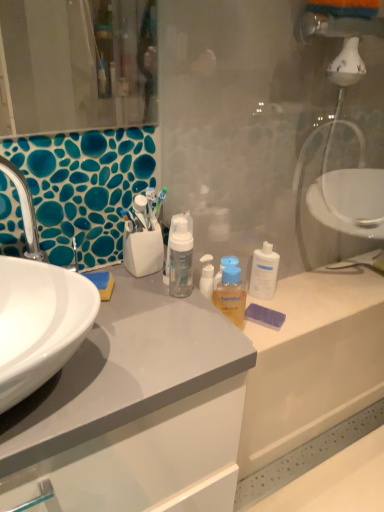
Question: Does white glossy sink at left have a lesser height compared to transparent plastic bottle at center?

Choices:
 (A) no
 (B) yes

Answer: (A)

Question: Is white glossy sink at left looking in the opposite direction of transparent plastic bottle at center?

Choices:
 (A) no
 (B) yes

Answer: (B)

Question: Can you confirm if white glossy sink at left is wider than transparent plastic bottle at center?

Choices:
 (A) yes
 (B) no

Answer: (A)

Question: Is white glossy sink at left outside transparent plastic bottle at center?

Choices:
 (A) no
 (B) yes

Answer: (B)

Question: Does white glossy sink at left have a greater height compared to transparent plastic bottle at center?

Choices:
 (A) yes
 (B) no

Answer: (A)

Question: Choose the correct answer: Is white glossy sink at left inside transparent plastic bottle at center or outside it?

Choices:
 (A) outside
 (B) inside

Answer: (A)

Question: From their relative heights in the image, would you say white glossy sink at left is taller or shorter than transparent plastic bottle at center?

Choices:
 (A) tall
 (B) short

Answer: (A)

Question: In terms of size, does white glossy sink at left appear bigger or smaller than transparent plastic bottle at center?

Choices:
 (A) small
 (B) big

Answer: (B)

Question: From the image's perspective, is white glossy sink at left above or below transparent plastic bottle at center?

Choices:
 (A) above
 (B) below

Answer: (A)

Question: Considering their positions, is transparent plastic bottle at center located in front of or behind transparent plastic glass door at center?

Choices:
 (A) behind
 (B) front

Answer: (A)

Question: Considering the positions of transparent plastic bottle at center and transparent plastic glass door at center in the image, is transparent plastic bottle at center taller or shorter than transparent plastic glass door at center?

Choices:
 (A) tall
 (B) short

Answer: (B)

Question: From the image's perspective, is transparent plastic bottle at center above or below transparent plastic glass door at center?

Choices:
 (A) below
 (B) above

Answer: (B)

Question: Considering the positions of transparent plastic bottle at center and transparent plastic glass door at center in the image, is transparent plastic bottle at center wider or thinner than transparent plastic glass door at center?

Choices:
 (A) wide
 (B) thin

Answer: (A)

Question: From the image's perspective, is white glossy sink at left positioned above or below translucent orange liquid at center?

Choices:
 (A) below
 (B) above

Answer: (B)

Question: Considering the relative positions of white glossy sink at left and translucent orange liquid at center in the image provided, is white glossy sink at left to the left or to the right of translucent orange liquid at center?

Choices:
 (A) left
 (B) right

Answer: (A)